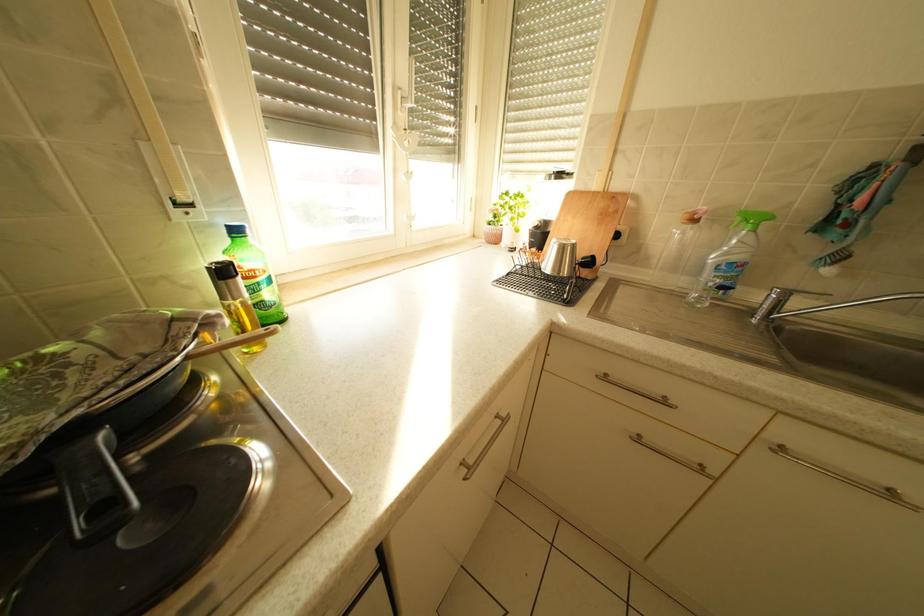
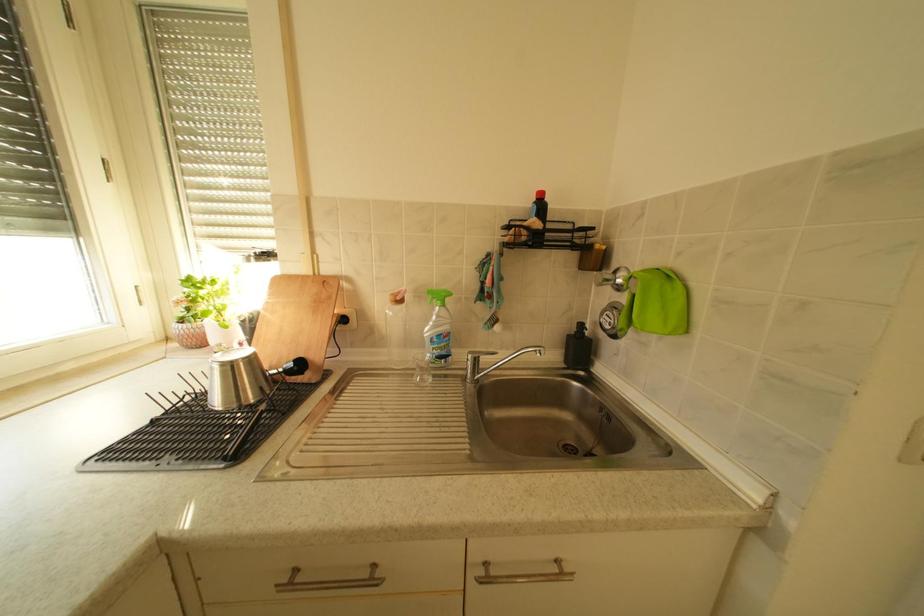
Question: The camera is either moving clockwise (left) or counter-clockwise (right) around the object. The first image is from the beginning of the video and the second image is from the end. Is the camera moving left or right when shooting the video?

Choices:
 (A) Left
 (B) Right

Answer: (A)